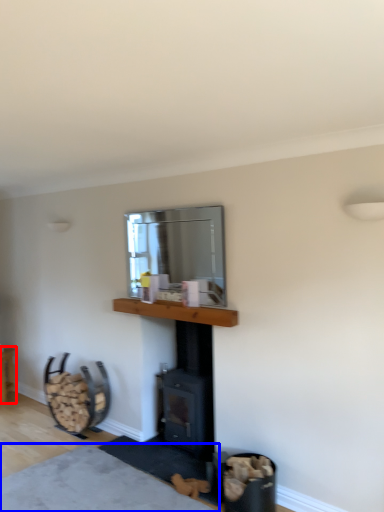
Question: Which object is closer to the camera taking this photo, furniture (highlighted by a red box) or plain (highlighted by a blue box)?

Choices:
 (A) furniture
 (B) plain

Answer: (B)